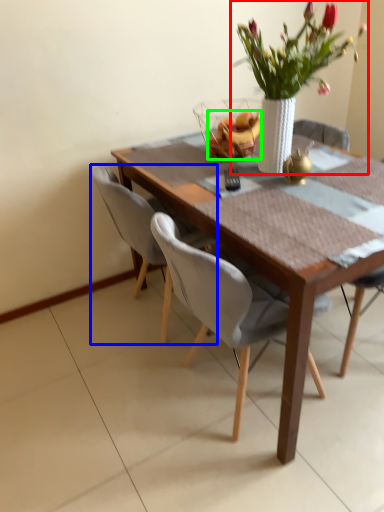
Question: Based on their relative distances, which object is farther from houseplant (highlighted by a red box)? Choose from chair (highlighted by a blue box) and fruit (highlighted by a green box).

Choices:
 (A) chair
 (B) fruit

Answer: (A)